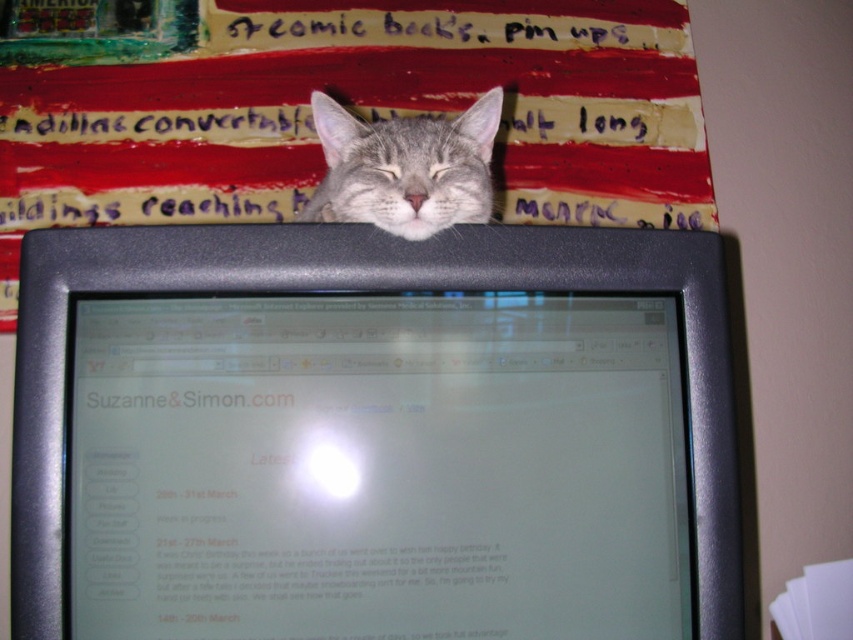
Is matte black monitor at center further to camera compared to gray fur cat at upper center?

No, it is in front of gray fur cat at upper center.

Where is `matte black monitor at center`? matte black monitor at center is located at coordinates pos(386,401).

From the picture: Who is more distant from viewer, (77, 355) or (463, 176)?

The point (463, 176) is behind.

You are a GUI agent. You are given a task and a screenshot of the screen. Output one action in this format:
    pyautogui.click(x=<x>, y=<y>)
    Task: Click on the matte black monitor at center
    This screenshot has height=640, width=853.
    Given the screenshot: What is the action you would take?
    pyautogui.click(x=386, y=401)